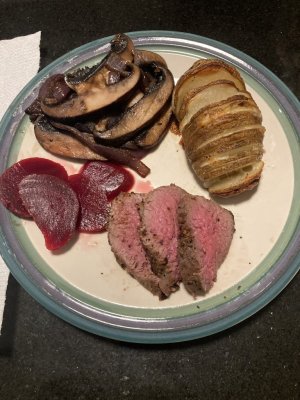
Find the location of a particular element. decorative rings on edge of plate is located at coordinates (176, 333), (176, 323), (174, 313).